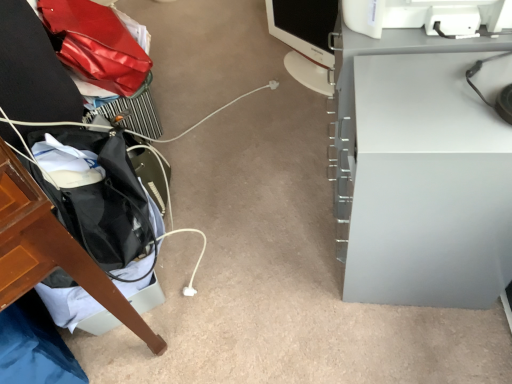
Question: Should I look upward or downward to see matte black monitor at center?

Choices:
 (A) down
 (B) up

Answer: (B)

Question: Is matte black monitor at center smaller than white matte computer desk at right?

Choices:
 (A) yes
 (B) no

Answer: (A)

Question: Is matte black monitor at center bigger than white matte computer desk at right?

Choices:
 (A) yes
 (B) no

Answer: (B)

Question: Does matte black monitor at center have a lesser width compared to white matte computer desk at right?

Choices:
 (A) yes
 (B) no

Answer: (A)

Question: From the image's perspective, is matte black monitor at center below white matte computer desk at right?

Choices:
 (A) no
 (B) yes

Answer: (A)

Question: Can we say matte black monitor at center lies outside white matte computer desk at right?

Choices:
 (A) no
 (B) yes

Answer: (B)

Question: From the image's perspective, is matte black monitor at center located above white matte computer desk at right?

Choices:
 (A) yes
 (B) no

Answer: (A)

Question: Is there a large distance between white matte computer desk at right and matte black monitor at center?

Choices:
 (A) yes
 (B) no

Answer: (B)

Question: Can you confirm if white matte computer desk at right is wider than matte black monitor at center?

Choices:
 (A) no
 (B) yes

Answer: (B)

Question: Would you say matte black monitor at center is part of white matte computer desk at right's contents?

Choices:
 (A) no
 (B) yes

Answer: (A)

Question: Does white matte computer desk at right have a lesser height compared to matte black monitor at center?

Choices:
 (A) yes
 (B) no

Answer: (B)

Question: Is white matte computer desk at right positioned before matte black monitor at center?

Choices:
 (A) yes
 (B) no

Answer: (A)

Question: Can you confirm if white matte computer desk at right is smaller than matte black monitor at center?

Choices:
 (A) yes
 (B) no

Answer: (B)

Question: From the image's perspective, is matte black monitor at center positioned above or below white matte computer desk at right?

Choices:
 (A) above
 (B) below

Answer: (A)